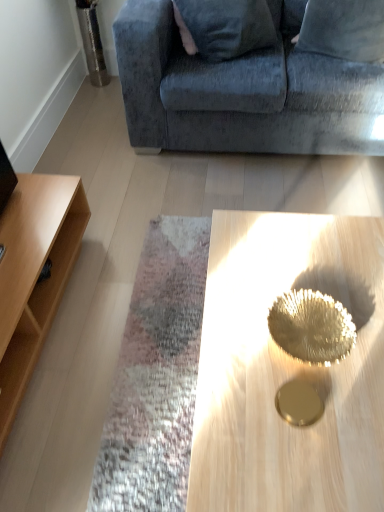
Where is `free space that is in between light wood shelf at left and gold metallic tray at center`? This screenshot has width=384, height=512. free space that is in between light wood shelf at left and gold metallic tray at center is located at coordinates (118, 357).